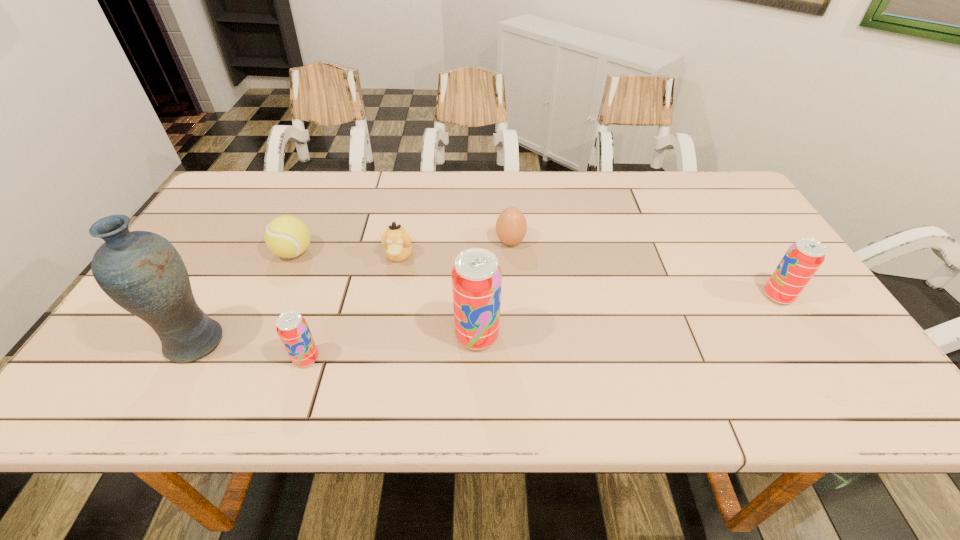
To ensure equal spacing by inserting another pop_(soda) among them, please point out a vacant spot for this new pop_(soda). Please provide its 2D coordinates. Your answer should be formatted as a tuple, i.e. [(x, y)], where the tuple contains the x and y coordinates of a point satisfying the conditions above.

[(634, 315)]